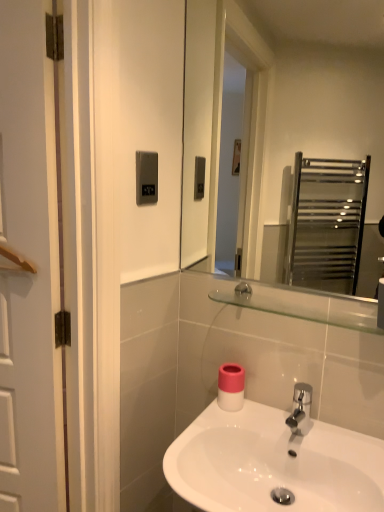
Question: Does pink matte toilet paper at center turn towards clear glass shelf at upper center?

Choices:
 (A) yes
 (B) no

Answer: (B)

Question: Is pink matte toilet paper at center to the right of clear glass shelf at upper center from the viewer's perspective?

Choices:
 (A) no
 (B) yes

Answer: (A)

Question: Is pink matte toilet paper at center next to clear glass shelf at upper center?

Choices:
 (A) no
 (B) yes

Answer: (A)

Question: Can you confirm if pink matte toilet paper at center is shorter than clear glass shelf at upper center?

Choices:
 (A) no
 (B) yes

Answer: (A)

Question: Considering the relative sizes of pink matte toilet paper at center and clear glass shelf at upper center in the image provided, is pink matte toilet paper at center taller than clear glass shelf at upper center?

Choices:
 (A) no
 (B) yes

Answer: (B)

Question: Can you confirm if pink matte toilet paper at center is wider than clear glass shelf at upper center?

Choices:
 (A) yes
 (B) no

Answer: (B)

Question: Considering the relative positions of clear glass mirror at upper center and satin silver panel at upper center in the image provided, is clear glass mirror at upper center behind satin silver panel at upper center?

Choices:
 (A) yes
 (B) no

Answer: (B)

Question: Is clear glass mirror at upper center facing away from satin silver panel at upper center?

Choices:
 (A) no
 (B) yes

Answer: (A)

Question: Is clear glass mirror at upper center to the left of satin silver panel at upper center from the viewer's perspective?

Choices:
 (A) yes
 (B) no

Answer: (B)

Question: Is clear glass mirror at upper center positioned beyond the bounds of satin silver panel at upper center?

Choices:
 (A) yes
 (B) no

Answer: (A)

Question: Considering the relative sizes of clear glass mirror at upper center and satin silver panel at upper center in the image provided, is clear glass mirror at upper center thinner than satin silver panel at upper center?

Choices:
 (A) no
 (B) yes

Answer: (A)

Question: Are clear glass mirror at upper center and satin silver panel at upper center beside each other?

Choices:
 (A) no
 (B) yes

Answer: (A)

Question: Considering the relative sizes of white glossy sink at center and clear glass mirror at upper center in the image provided, is white glossy sink at center wider than clear glass mirror at upper center?

Choices:
 (A) no
 (B) yes

Answer: (B)